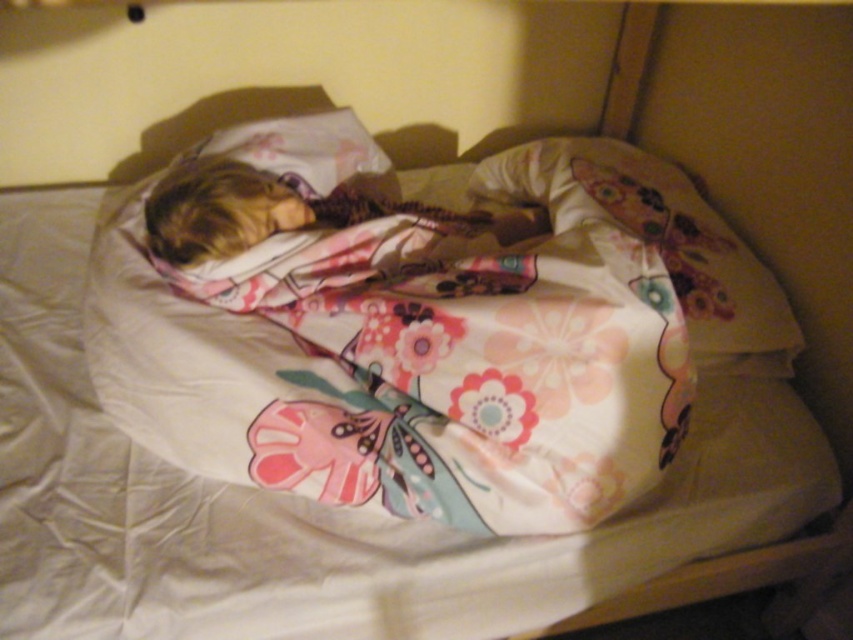
Question: Which point is closer to the camera taking this photo?

Choices:
 (A) (200, 230)
 (B) (583, 196)

Answer: (A)

Question: Among these points, which one is nearest to the camera?

Choices:
 (A) (612, 481)
 (B) (289, 188)

Answer: (A)

Question: Does floral fabric pillow at center have a larger size compared to fluffy pink blanket at center?

Choices:
 (A) no
 (B) yes

Answer: (B)

Question: Where is floral fabric pillow at center located in relation to fluffy pink blanket at center in the image?

Choices:
 (A) above
 (B) below

Answer: (B)

Question: Which point is farther to the camera?

Choices:
 (A) floral fabric blanket at center
 (B) floral fabric pillow at center

Answer: (B)

Question: Does floral fabric blanket at center appear on the right side of fluffy pink blanket at center?

Choices:
 (A) no
 (B) yes

Answer: (B)